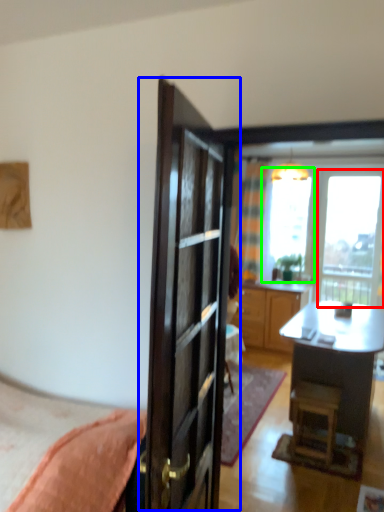
Question: Which is farther away from window (highlighted by a red box)? door (highlighted by a blue box) or window screen (highlighted by a green box)?

Choices:
 (A) door
 (B) window screen

Answer: (A)